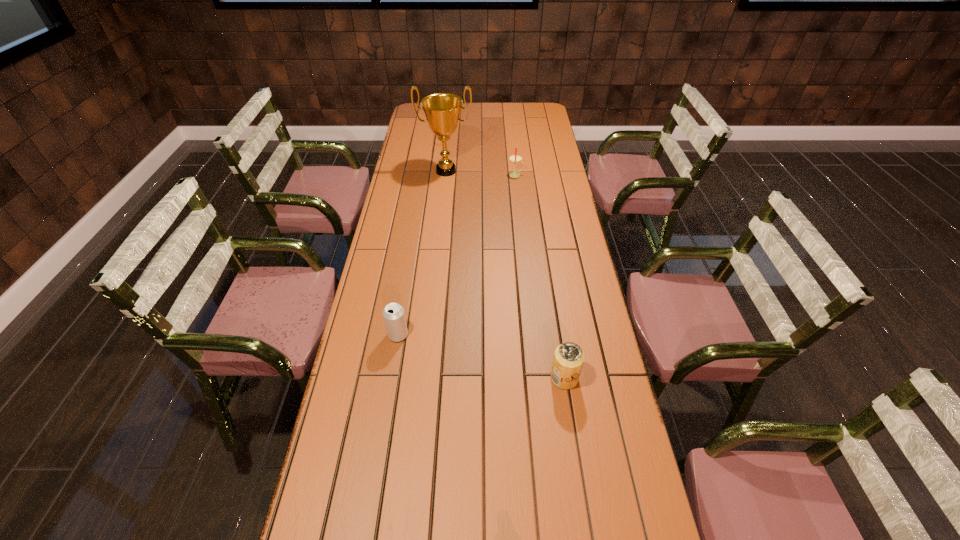
At what (x,y) coordinates should I click in order to perform the action: click on empty space that is in between the left beer can and the award. Please return your answer as a coordinate pair (x, y). The height and width of the screenshot is (540, 960). Looking at the image, I should click on (422, 253).

Locate an element on the screen. The width and height of the screenshot is (960, 540). free space between the tallest object and the left beer can is located at coordinates (422, 253).

Identify which object is located as the nearest to the farther beer can. Please provide its 2D coordinates. Your answer should be formatted as a tuple, i.e. [(x, y)], where the tuple contains the x and y coordinates of a point satisfying the conditions above.

[(568, 360)]

Locate an element on the screen. object that is the closest one to the award is located at coordinates (515, 158).

Locate an element on the screen. This screenshot has width=960, height=540. free space that satisfies the following two spatial constraints: 1. on the front view with handles of the third object from left to right; 2. on the left side of the award is located at coordinates (445, 175).

Locate an element on the screen. The height and width of the screenshot is (540, 960). vacant space that satisfies the following two spatial constraints: 1. on the front side of the left beer can; 2. on the right side of the rightmost object is located at coordinates (391, 378).

Find the location of a particular element. vacant region that satisfies the following two spatial constraints: 1. on the front view with handles of the candle; 2. on the right side of the tallest object is located at coordinates (445, 175).